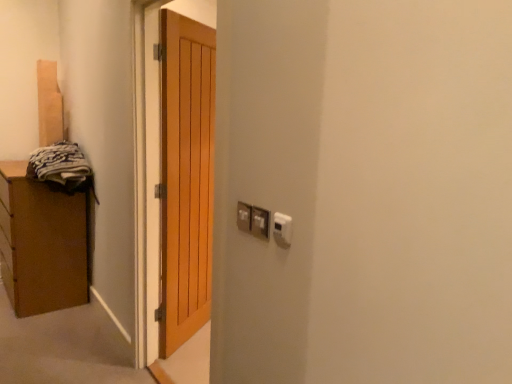
Question: Which direction should I rotate to look at white plastic electric outlet at center, which is counted as the 3th electric outlet, starting from the front, — up or down?

Choices:
 (A) up
 (B) down

Answer: (B)

Question: Can white plastic thermostat at upper right, marked as the first electric outlet in a front-to-back arrangement, be found inside light brown wooden door at center?

Choices:
 (A) yes
 (B) no

Answer: (B)

Question: From a real-world perspective, is light brown wooden door at center positioned over white plastic thermostat at upper right, marked as the first electric outlet in a front-to-back arrangement, based on gravity?

Choices:
 (A) yes
 (B) no

Answer: (B)

Question: Considering the relative sizes of light brown wooden door at center and white plastic thermostat at upper right, which is counted as the third electric outlet, starting from the back, in the image provided, is light brown wooden door at center thinner than white plastic thermostat at upper right, which is counted as the third electric outlet, starting from the back,?

Choices:
 (A) yes
 (B) no

Answer: (B)

Question: Can you confirm if light brown wooden door at center is taller than white plastic thermostat at upper right, marked as the first electric outlet in a front-to-back arrangement?

Choices:
 (A) no
 (B) yes

Answer: (B)

Question: Can you confirm if light brown wooden door at center is bigger than white plastic thermostat at upper right, marked as the first electric outlet in a front-to-back arrangement?

Choices:
 (A) no
 (B) yes

Answer: (B)

Question: Is the position of light brown wooden door at center less distant than that of white plastic thermostat at upper right, marked as the first electric outlet in a front-to-back arrangement?

Choices:
 (A) yes
 (B) no

Answer: (B)

Question: Is white plastic thermostat at upper right, marked as the first electric outlet in a front-to-back arrangement, in front of white plastic electric outlet at center, which is counted as the 3th electric outlet, starting from the front?

Choices:
 (A) no
 (B) yes

Answer: (B)

Question: From a real-world perspective, is white plastic thermostat at upper right, marked as the first electric outlet in a front-to-back arrangement, under white plastic electric outlet at center, which appears as the first electric outlet when viewed from the back?

Choices:
 (A) no
 (B) yes

Answer: (B)

Question: Is white plastic thermostat at upper right, which is counted as the third electric outlet, starting from the back, positioned behind white plastic electric outlet at center, which is counted as the 3th electric outlet, starting from the front?

Choices:
 (A) yes
 (B) no

Answer: (B)

Question: Does white plastic thermostat at upper right, which is counted as the third electric outlet, starting from the back, have a lesser width compared to white plastic electric outlet at center, which is counted as the 3th electric outlet, starting from the front?

Choices:
 (A) yes
 (B) no

Answer: (A)

Question: Are white plastic thermostat at upper right, marked as the first electric outlet in a front-to-back arrangement, and white plastic electric outlet at center, which appears as the first electric outlet when viewed from the back, beside each other?

Choices:
 (A) yes
 (B) no

Answer: (B)

Question: Does white plastic thermostat at upper right, which is counted as the third electric outlet, starting from the back, have a greater width compared to white plastic electric outlet at center, which appears as the first electric outlet when viewed from the back?

Choices:
 (A) no
 (B) yes

Answer: (A)

Question: Could you tell me if metallic silver electrical outlet at center-right, positioned as the 2th electric outlet in front-to-back order, is facing dark gray fabric at left?

Choices:
 (A) yes
 (B) no

Answer: (B)